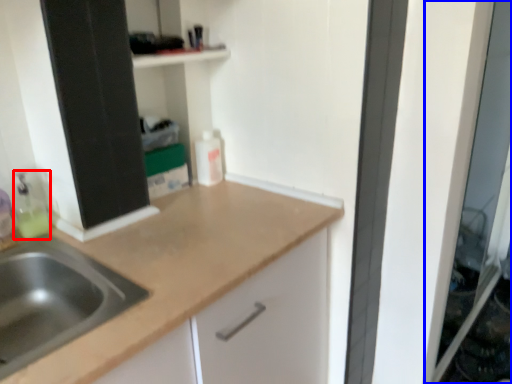
Question: Which object is further to the camera taking this photo, cleaning product (highlighted by a red box) or screen door (highlighted by a blue box)?

Choices:
 (A) cleaning product
 (B) screen door

Answer: (B)